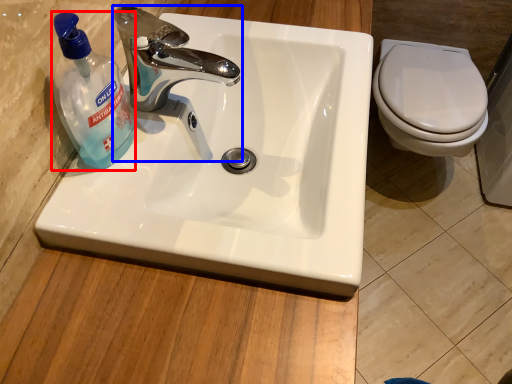
Question: Which of the following is the farthest to the observer, cleaning product (highlighted by a red box) or tap (highlighted by a blue box)?

Choices:
 (A) cleaning product
 (B) tap

Answer: (B)